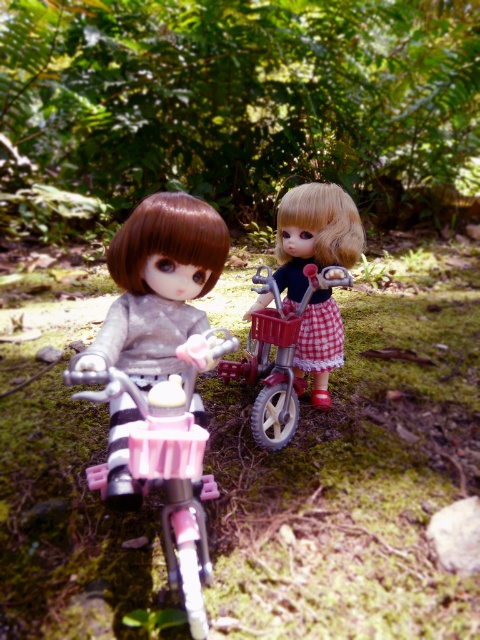
Measure the distance from matte silver doll at left to matte black doll at center.

matte silver doll at left and matte black doll at center are 30.07 inches apart.

Which is above, matte silver doll at left or matte black doll at center?

matte black doll at center

Does point (204, 205) lie in front of point (287, 301)?

Yes, point (204, 205) is closer to viewer.

You are a GUI agent. You are given a task and a screenshot of the screen. Output one action in this format:
    pyautogui.click(x=<x>, y=<y>)
    Task: Click on the matte silver doll at left
    The width and height of the screenshot is (480, 640).
    Given the screenshot: What is the action you would take?
    pyautogui.click(x=157, y=285)

Does pink plastic bicycle at left appear on the left side of matte black doll at center?

Correct, you'll find pink plastic bicycle at left to the left of matte black doll at center.

Is the position of pink plastic bicycle at left more distant than that of matte black doll at center?

That is False.

Measure the distance between pink plastic bicycle at left and camera.

The distance of pink plastic bicycle at left from camera is 4.04 feet.

This screenshot has height=640, width=480. In order to click on pink plastic bicycle at left in this screenshot , I will do `click(165, 460)`.

Is matte black doll at center below metallic silver bicycle at center?

Incorrect, matte black doll at center is not positioned below metallic silver bicycle at center.

Who is more distant from viewer, (336, 332) or (259, 288)?

Positioned behind is point (336, 332).

You are a GUI agent. You are given a task and a screenshot of the screen. Output one action in this format:
    pyautogui.click(x=<x>, y=<y>)
    Task: Click on the matte black doll at center
    The width and height of the screenshot is (480, 640).
    Given the screenshot: What is the action you would take?
    pyautogui.click(x=314, y=234)